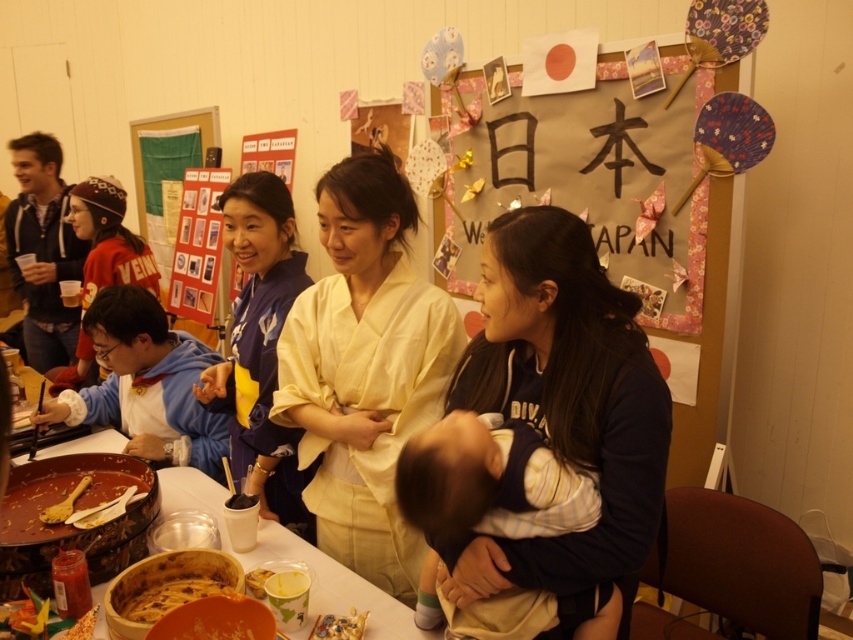
You are at the event and want to find the nearest signboard. Which object is closest to the point (590,177)?

The point (590,177) is on the matte cardboard signboard at upper center, so the nearest signboard is the matte cardboard signboard at upper center.

You are attending a cultural event and see two garments displayed in the scene. The light beige kimono at center and the matte black robe at left. Which garment is taller in height?

The light beige kimono at center is taller than the matte black robe at left.